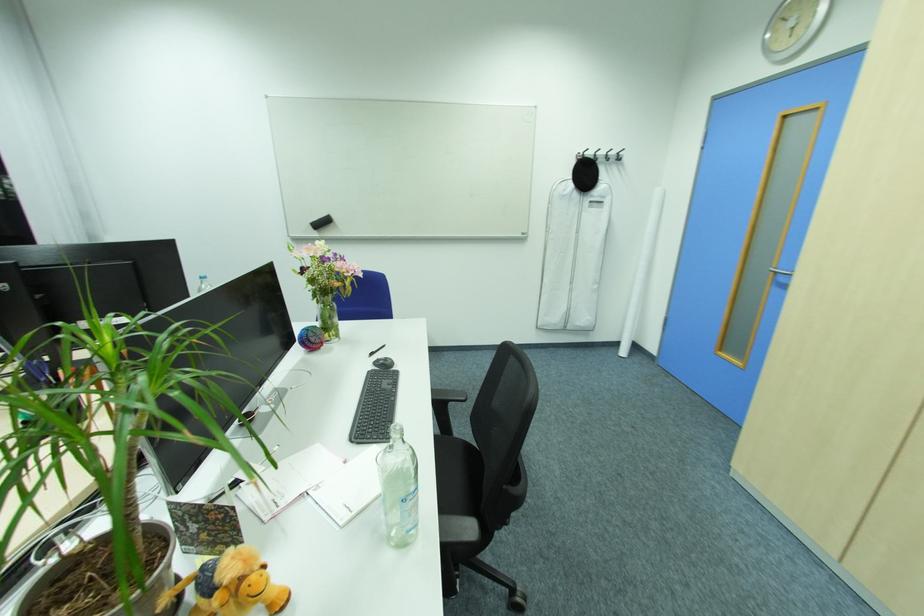
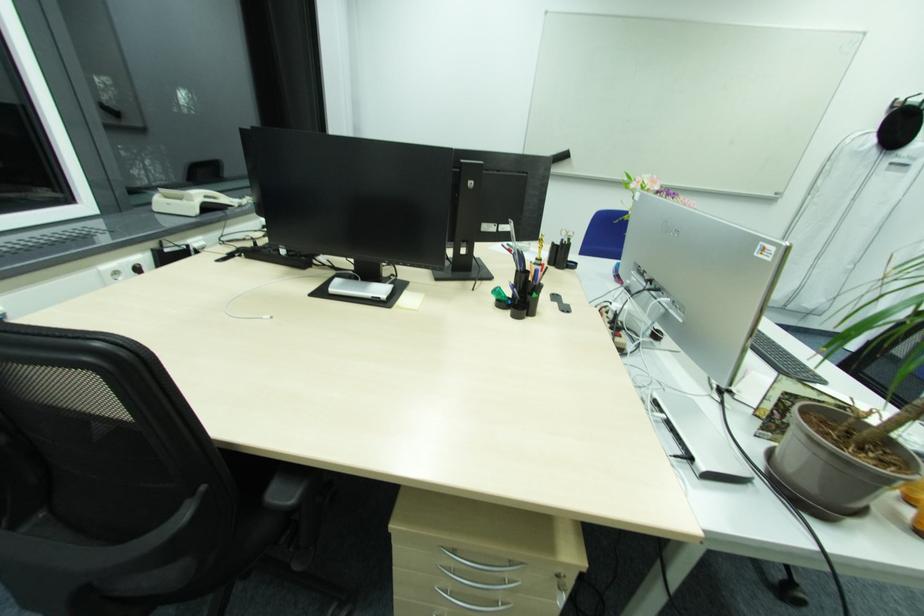
In the second image, find the point that corresponds to (x=577, y=177) in the first image.

(881, 130)